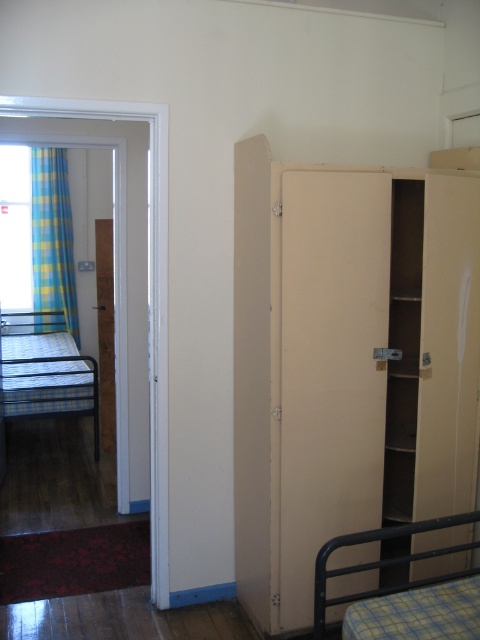
Does metallic blue plaid bed at left have a greater height compared to blue plaid fabric at left?

Incorrect, metallic blue plaid bed at left's height is not larger of blue plaid fabric at left's.

Who is higher up, metallic blue plaid bed at left or blue plaid fabric at left?

Positioned higher is blue plaid fabric at left.

Between point (11, 317) and point (62, 285), which one is positioned in front?

Point (11, 317) is more forward.

At what (x,y) coordinates should I click in order to perform the action: click on metallic blue plaid bed at left. Please return your answer as a coordinate pair (x, y). The width and height of the screenshot is (480, 640). Looking at the image, I should click on (46, 371).

Does blue plaid fabric at left have a larger size compared to plaid fabric bunk bed at lower right?

Correct, blue plaid fabric at left is larger in size than plaid fabric bunk bed at lower right.

Who is positioned more to the left, blue plaid fabric at left or plaid fabric bunk bed at lower right?

blue plaid fabric at left

Which is in front, point (60, 298) or point (314, 636)?

Positioned in front is point (314, 636).

Where is `blue plaid fabric at left`? blue plaid fabric at left is located at coordinates (52, 236).

Looking at this image, who is more forward, (338, 384) or (61, 176)?

Positioned in front is point (338, 384).

Is beige matte cabinet at right smaller than blue plaid fabric at left?

No, beige matte cabinet at right is not smaller than blue plaid fabric at left.

Where is `beige matte cabinet at right`? beige matte cabinet at right is located at coordinates (348, 362).